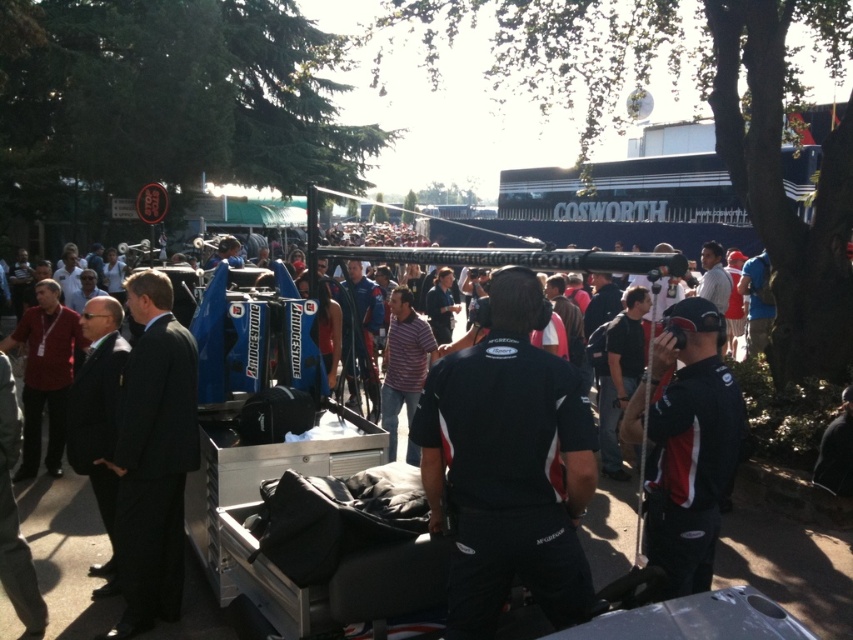
You are standing at the starting line of the race track and see two points marked on the track. The first point is at coordinate point(144,384) and the second point is at coordinate point(653,472). Which point is closer to the starting line?

Point(144,384) is closer to the starting line because it is behind point(653,472).

You are a photographer at the event and want to capture a photo of the black fabric shirt at center and dark suit at center together. The camera you are using has a maximum focus range of 6 feet. Can you fit both subjects into the frame without moving the camera?

The distance between the black fabric shirt at center and dark suit at center is 6.75 feet, which exceeds the camera maximum focus range of 6 feet. Therefore, you cannot fit both subjects into the frame without moving the camera.

You are a photographer positioned at the camera. You want to capture a closeup shot of the black fabric shirt at center. Given that your camera has a minimum focusing distance of 8 feet, will you be able to take the photo without moving closer?

The distance between the black fabric shirt at center and the camera is 8.20 feet. Since the minimum focusing distance is 8 feet, you can take the photo without moving closer as the shirt is just beyond the required distance.